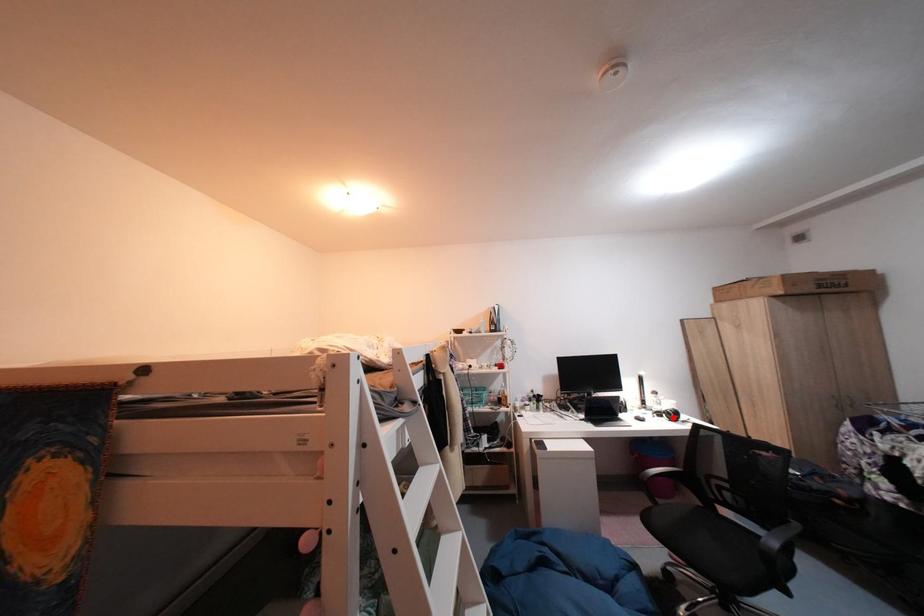
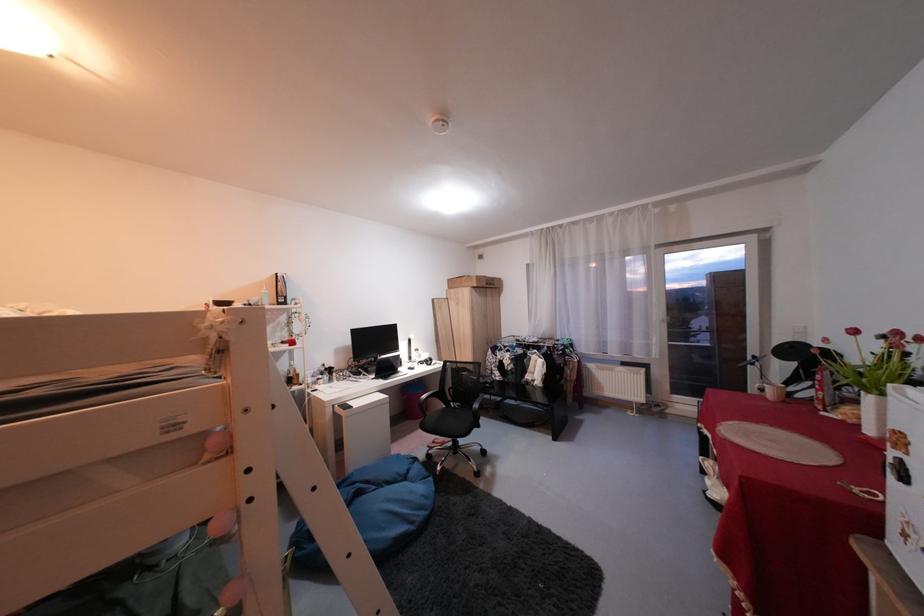
Question: I am providing you with two images of the same scene from different viewpoints. A red point is marked on the first image. Can you still see the location of the red point in image 2?

Choices:
 (A) Yes
 (B) No

Answer: (B)